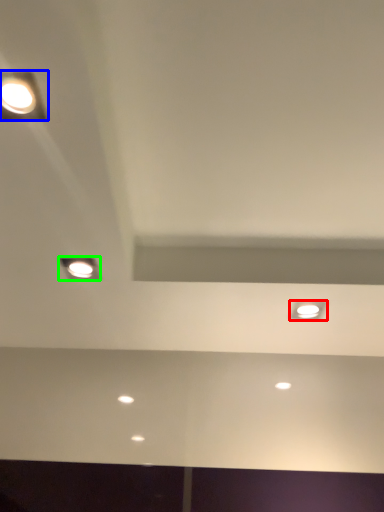
Question: Which object is positioned closest to dot (highlighted by a red box)? Select from lamp (highlighted by a blue box) and lamp (highlighted by a green box).

Choices:
 (A) lamp
 (B) lamp

Answer: (B)